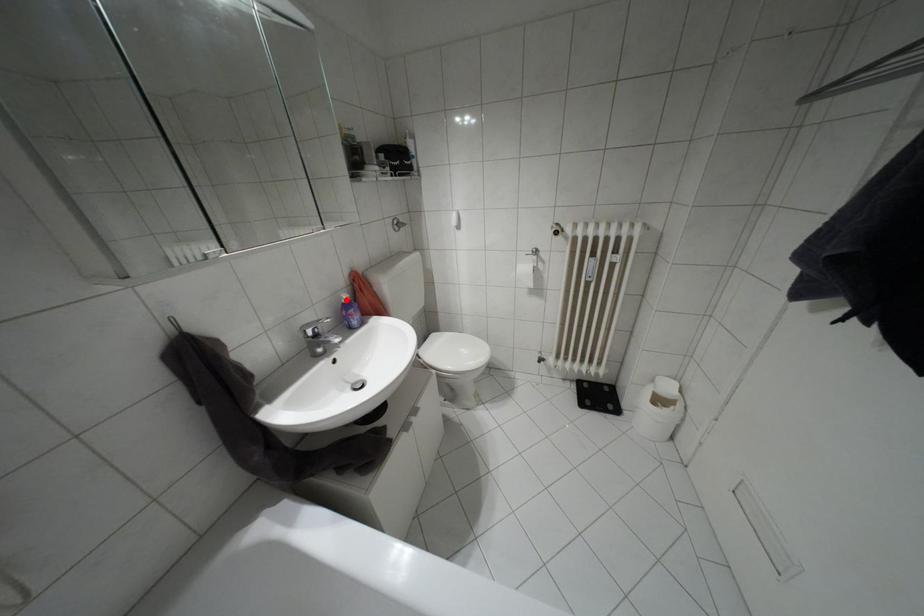
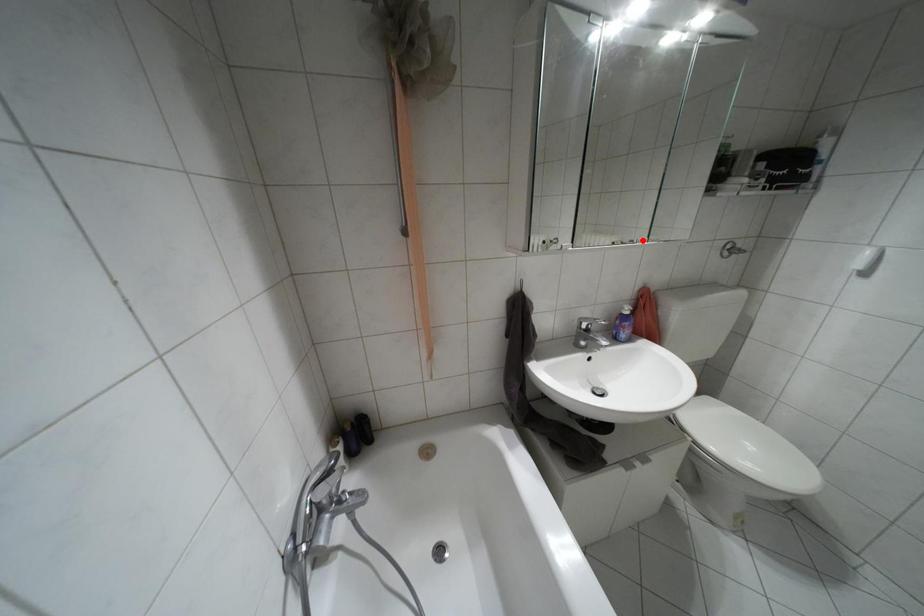
I am providing you with two images of the same scene from different viewpoints. A red point is marked on the first image and another point is marked on the second image. Do the highlighted points in image1 and image2 indicate the same real-world spot?

No